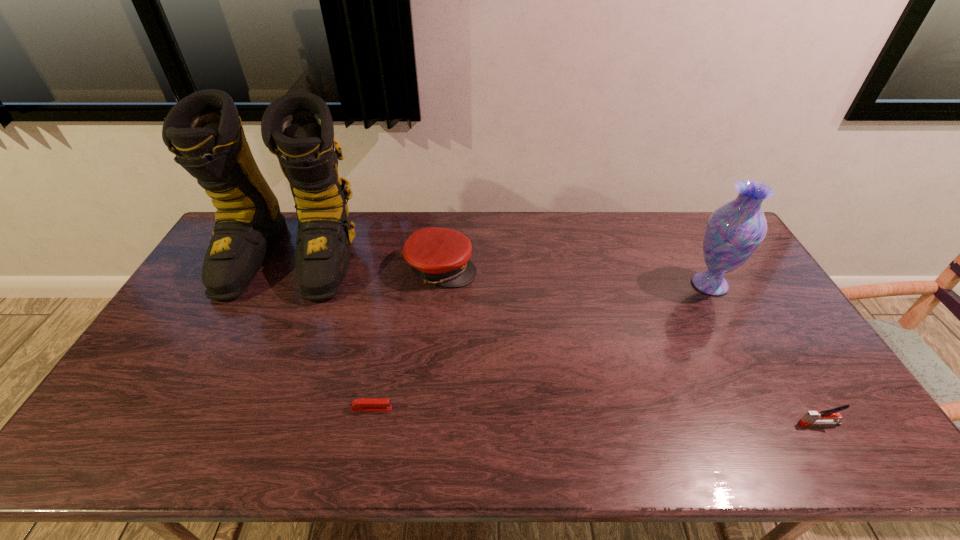
The image size is (960, 540). Find the location of `object located at the far left corner`. object located at the far left corner is located at coordinates (204, 131).

Identify the location of free space at the far edge of the desktop. The width and height of the screenshot is (960, 540). (530, 219).

The height and width of the screenshot is (540, 960). What are the coordinates of `vacant space at the near edge of the desktop` in the screenshot? It's located at (706, 436).

At what (x,y) coordinates should I click in order to perform the action: click on blank space at the far right corner. Please return your answer as a coordinate pair (x, y). Image resolution: width=960 pixels, height=540 pixels. Looking at the image, I should click on (701, 217).

The width and height of the screenshot is (960, 540). In the image, there is a desktop. Find the location of `vacant space at the near right corner`. vacant space at the near right corner is located at coordinates tap(876, 453).

The width and height of the screenshot is (960, 540). I want to click on free space between the leftmost object and the vase, so click(500, 272).

The width and height of the screenshot is (960, 540). Identify the location of vacant point located between the ski boots and the vase. (500, 272).

The height and width of the screenshot is (540, 960). I want to click on unoccupied position between the left stapler and the fourth shortest object, so click(540, 347).

The image size is (960, 540). Identify the location of free space between the shortest object and the cap. (407, 339).

At what (x,y) coordinates should I click in order to perform the action: click on empty space that is in between the second nearest object and the fourth shortest object. Please return your answer as a coordinate pair (x, y). The height and width of the screenshot is (540, 960). Looking at the image, I should click on (540, 347).